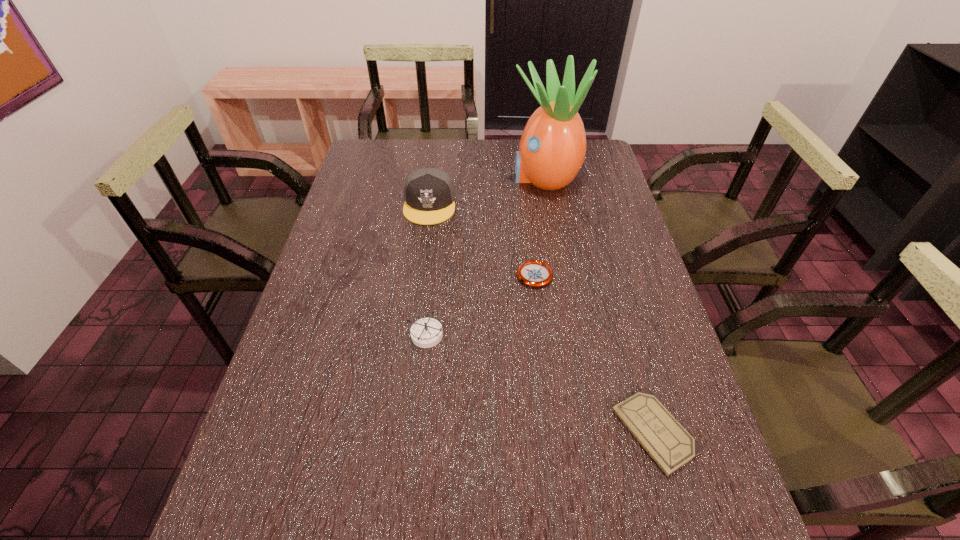
Identify the location of pineapple. (552, 149).

Where is `the fourth shortest object`? This screenshot has width=960, height=540. the fourth shortest object is located at coordinates (429, 193).

In order to click on the taller compass in this screenshot , I will do `click(427, 332)`.

Locate an element on the screen. The width and height of the screenshot is (960, 540). the left compass is located at coordinates (427, 332).

Where is `the third nearest object`? the third nearest object is located at coordinates (533, 273).

You are a GUI agent. You are given a task and a screenshot of the screen. Output one action in this format:
    pyautogui.click(x=<x>, y=<y>)
    Task: Click on the farther compass
    The height and width of the screenshot is (540, 960).
    Given the screenshot: What is the action you would take?
    pyautogui.click(x=533, y=273)

Find the location of a particular element. the shortest object is located at coordinates (671, 446).

Locate an element on the screen. the nearest object is located at coordinates (671, 446).

What are the coordinates of `vacant space located 0.400m at the entrance of the pineapple` in the screenshot? It's located at 396,177.

Locate an element on the screen. free point located at the entrance of the pineapple is located at coordinates (490, 177).